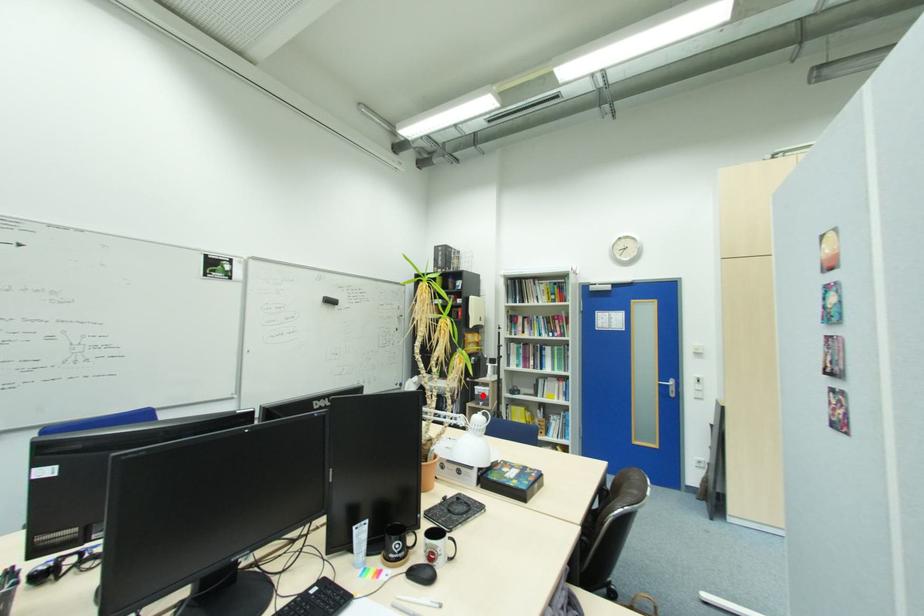
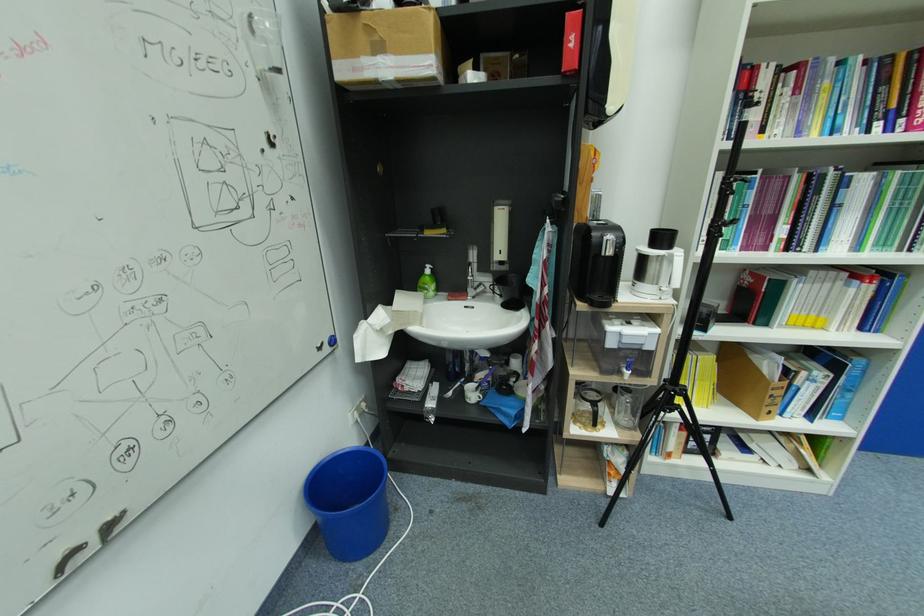
In the second image, find the point that corresponds to the highlighted location in the first image.

(623, 350)